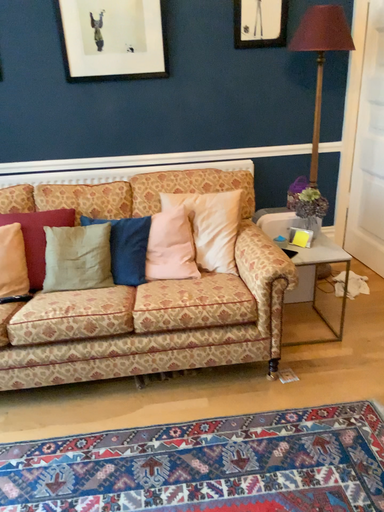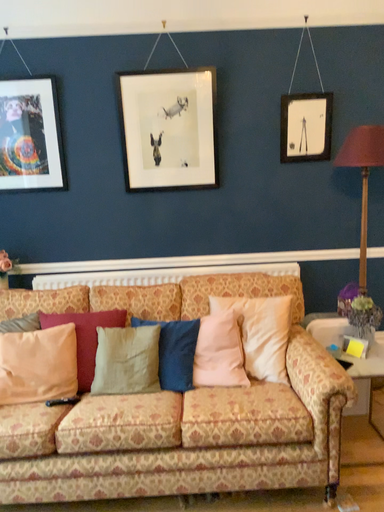
Question: How did the camera likely rotate when shooting the video?

Choices:
 (A) rotated downward
 (B) rotated upward

Answer: (B)